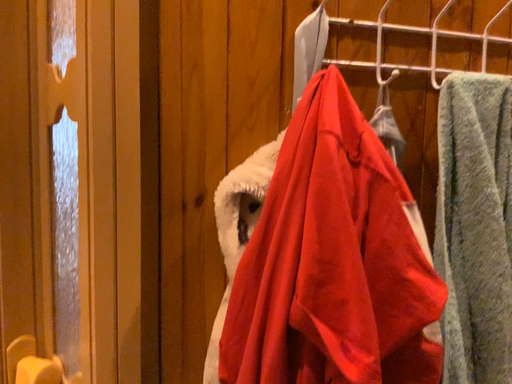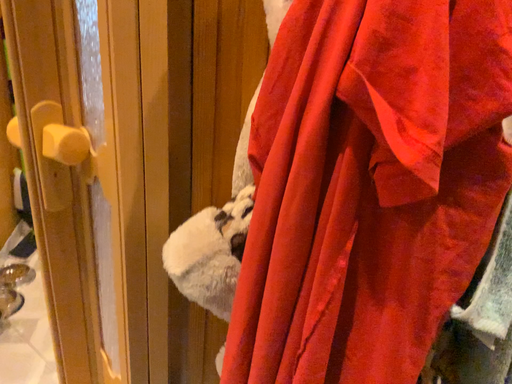
Question: Which way did the camera rotate in the video?

Choices:
 (A) rotated left
 (B) rotated right

Answer: (A)